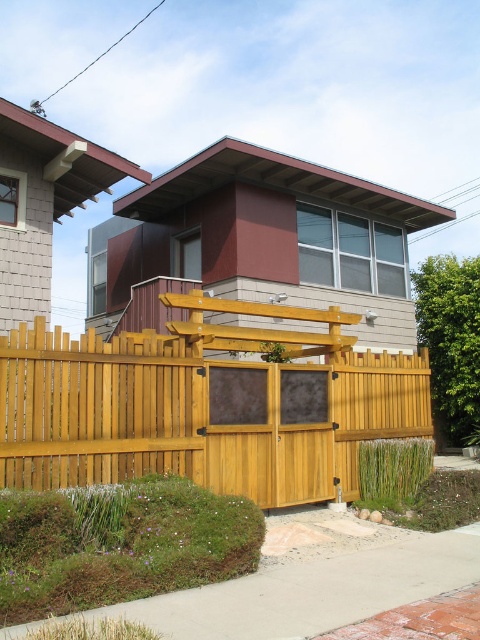
You are standing in front of the house and want to enter through the gate. Where is the light brown wood fence at center located relative to the house?

The light brown wood fence at center is located at point 0.633 on the x axis and 0.427 on the y axis relative to the house.

In the scene shown: You are standing at the front of the house and looking towards the gate. Which object is positioned higher relative to the other between the light brown wood fence at center and the green grass at lower left?

The light brown wood fence at center is positioned above the green grass at lower left, so it is higher.